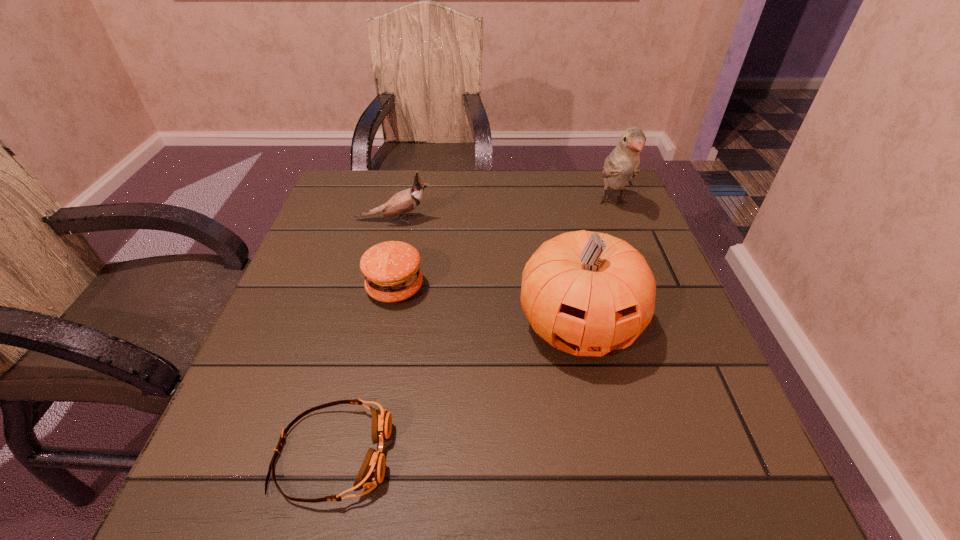
I want to click on vacant space located 0.310m at the face of the left bird, so click(559, 220).

Where is `free space located on the left of the patty`? The image size is (960, 540). free space located on the left of the patty is located at coordinates (319, 288).

The height and width of the screenshot is (540, 960). What are the coordinates of `vacant space located 0.380m with the lenses facing forward on the goggles` in the screenshot? It's located at (643, 454).

Identify the location of object that is at the near edge. (371, 473).

Where is `bird that is positioned at the left edge`? bird that is positioned at the left edge is located at coordinates (406, 201).

You are a GUI agent. You are given a task and a screenshot of the screen. Output one action in this format:
    pyautogui.click(x=<x>, y=<y>)
    Task: Click on the goggles that is at the left edge
    The height and width of the screenshot is (540, 960).
    Given the screenshot: What is the action you would take?
    pyautogui.click(x=371, y=473)

This screenshot has height=540, width=960. I want to click on bird positioned at the right edge, so 623,163.

Locate an element on the screen. The width and height of the screenshot is (960, 540). pumpkin situated at the right edge is located at coordinates (586, 293).

Find the location of a particular element. Image resolution: width=960 pixels, height=540 pixels. object at the far left corner is located at coordinates (406, 201).

The height and width of the screenshot is (540, 960). Find the location of `object present at the near left corner`. object present at the near left corner is located at coordinates (371, 473).